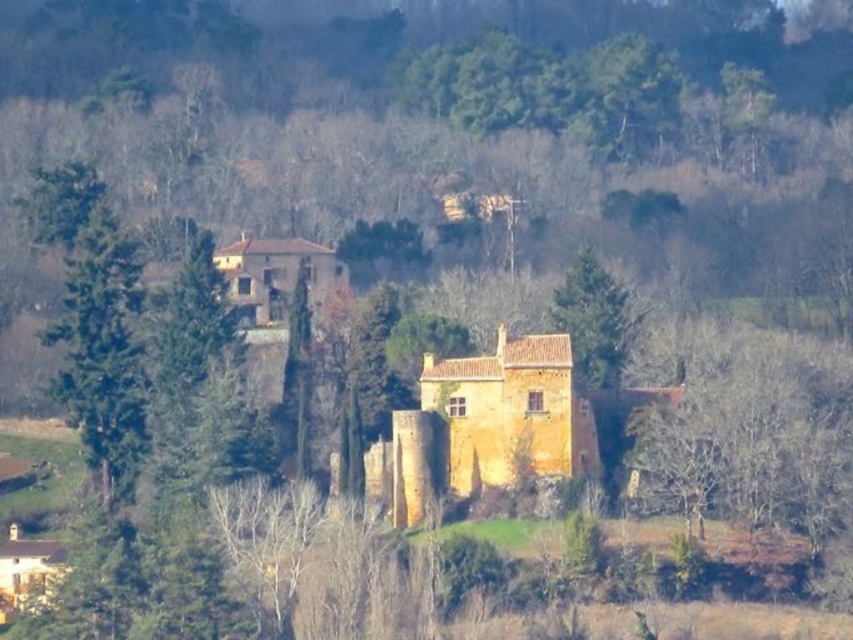
What do you see at coordinates (495, 424) in the screenshot? The height and width of the screenshot is (640, 853). I see `yellow stone castle at center` at bounding box center [495, 424].

Can you confirm if yellow stone castle at center is wider than green rough bark tree at left?

Yes.

Locate an element on the screen. The height and width of the screenshot is (640, 853). yellow stone castle at center is located at coordinates (495, 424).

Does yellow stone castle at center appear over green textured tree at center?

Actually, yellow stone castle at center is below green textured tree at center.

Where is `yellow stone castle at center`? yellow stone castle at center is located at coordinates (495, 424).

Identify the location of yellow stone castle at center. (495, 424).

How distant is green rough bark tree at left from green textured tree at center?

The distance of green rough bark tree at left from green textured tree at center is 37.08 meters.

Does point (84, 410) come closer to viewer compared to point (601, 330)?

Yes, it is.

Which is in front, point (32, 204) or point (596, 358)?

Point (596, 358) is more forward.

Find the location of a particular element. green rough bark tree at left is located at coordinates (93, 321).